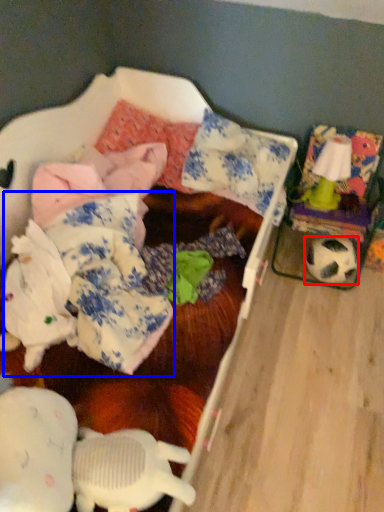
Question: Which of the following is the closest to the observer, football (highlighted by a red box) or clothing (highlighted by a blue box)?

Choices:
 (A) football
 (B) clothing

Answer: (B)